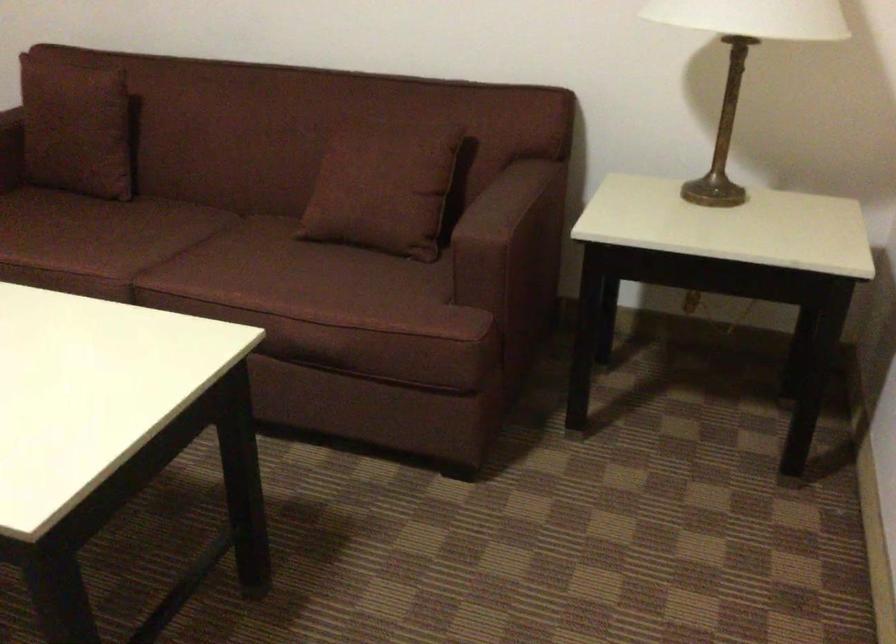
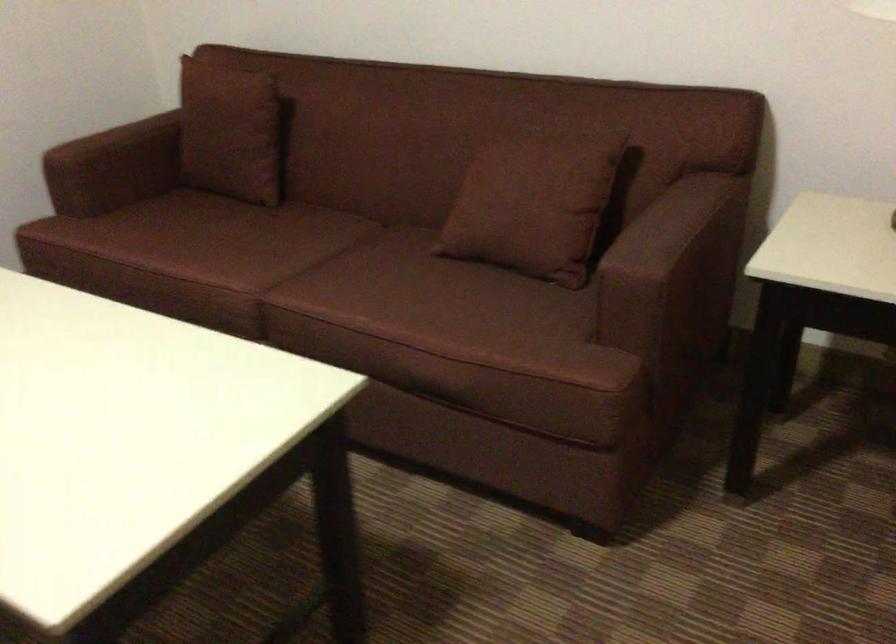
Which direction would the cameraman need to move to produce the second image?

The cameraman walked toward right, forward.